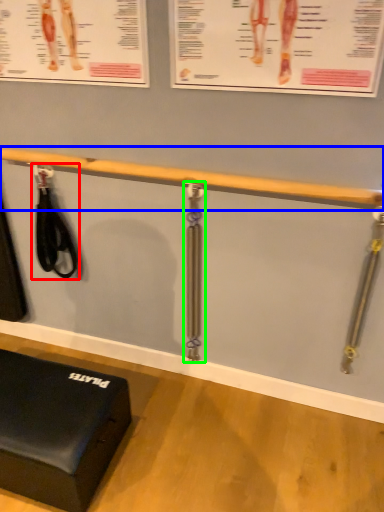
Question: Which object is positioned closest to tool (highlighted by a red box)? Select from beam (highlighted by a blue box) and tool (highlighted by a green box).

Choices:
 (A) beam
 (B) tool

Answer: (A)